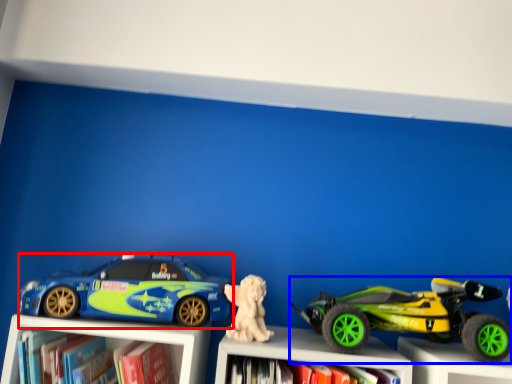
Question: Which object is closer to the camera taking this photo, car (highlighted by a red box) or toy (highlighted by a blue box)?

Choices:
 (A) car
 (B) toy

Answer: (B)